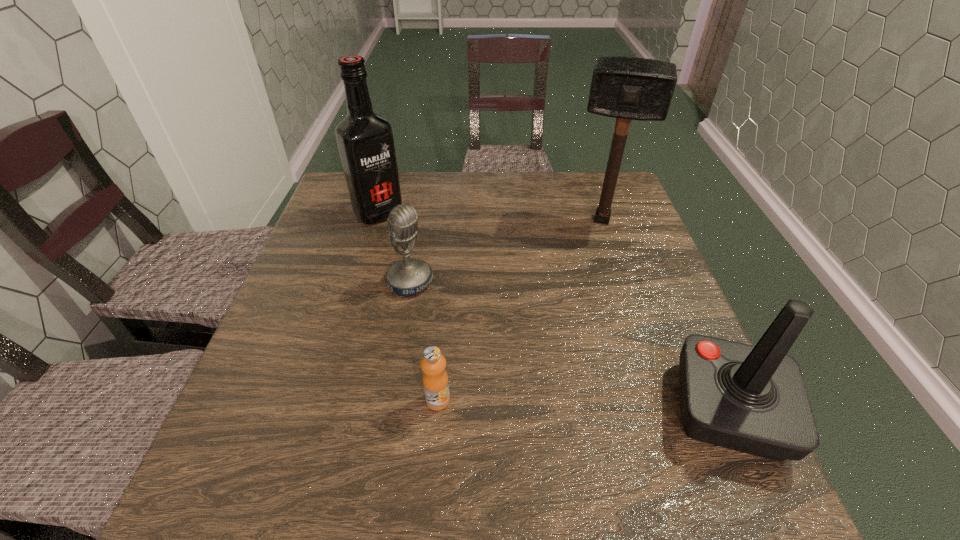
The height and width of the screenshot is (540, 960). I want to click on vacant space at the left edge of the desktop, so click(358, 289).

In the image, there is a desktop. Where is `vacant space at the right edge`? The height and width of the screenshot is (540, 960). vacant space at the right edge is located at coordinates (645, 234).

Identify the location of vacant region at the far left corner. (342, 215).

Where is `vacant space at the far right corner`? vacant space at the far right corner is located at coordinates (622, 185).

Identify the location of free point between the fourth tallest object and the mallet. The image size is (960, 540). (506, 251).

I want to click on vacant space in between the third tallest object and the fourth tallest object, so click(x=569, y=346).

The width and height of the screenshot is (960, 540). I want to click on free space between the third tallest object and the liquor, so click(x=554, y=312).

Find the location of a particular element. Image resolution: width=960 pixels, height=540 pixels. free space between the orange juice and the mallet is located at coordinates (519, 310).

Where is `empty space that is in between the mallet and the joystick`? empty space that is in between the mallet and the joystick is located at coordinates (665, 315).

What are the coordinates of `free spot between the third tallest object and the microphone` in the screenshot? It's located at (569, 346).